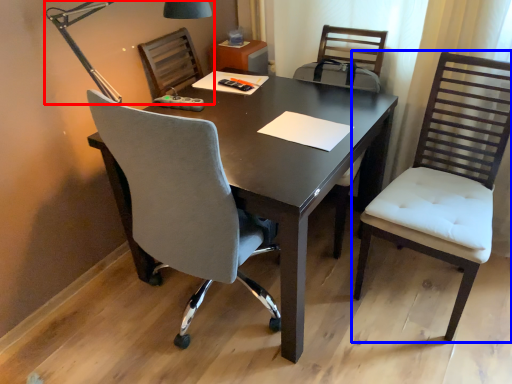
Question: Among these objects, which one is farthest to the camera, lamp (highlighted by a red box) or chair (highlighted by a blue box)?

Choices:
 (A) lamp
 (B) chair

Answer: (A)